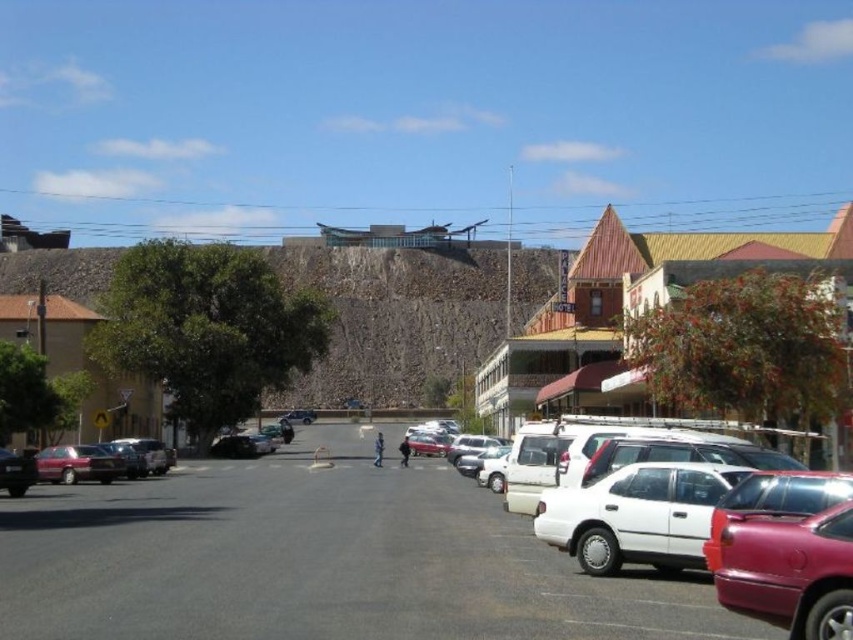
You are a delivery driver who needs to park your van between the white matte car at center and the matte red sedan at lower left. Based on the scene, can you fit your van there?

The white matte car at center is located above the matte red sedan at lower left, so there is space between them. However, the exact dimensions of the space aren generated in the description, so it is uncertain if the van will fit.

You are standing at the point with coordinates 0.5, 0.5 in the image. You want to walk to the white matte car at center. In which direction should you move relative to your current position?

Since the white matte car at center is located at point (x=318, y=560), which is to the right and slightly above your current position at (x=426, y=320), you should move in the direction of northeast to reach it.

You are a delivery person trying to park your 1.8 meters tall delivery box between the white matte sedan at right and the matte red sedan at lower left. Can you fit it vertically between them?

The white matte sedan at right is taller than the matte red sedan at lower left. Since the delivery box is 1.8 meters tall, you need to ensure there is enough vertical space between the two sedans. However, without knowing the exact height difference or the available space between them, it is impossible to determine if the box will fit vertically.